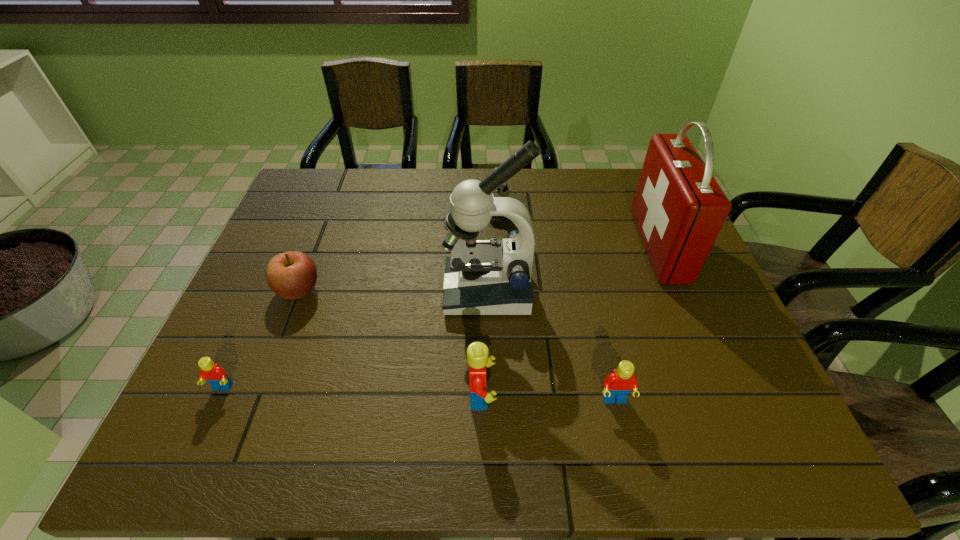
The image size is (960, 540). Find the location of `vacant space that's between the first-aid kit and the microphone`. vacant space that's between the first-aid kit and the microphone is located at coordinates tap(569, 230).

Identify the location of unoccupied position between the tallest Lego and the microscope. The height and width of the screenshot is (540, 960). (485, 343).

In order to click on free spot between the sixth shortest object and the tallest Lego in this screenshot , I will do `click(570, 321)`.

This screenshot has width=960, height=540. Find the location of `vacant space in between the apple and the rightmost Lego`. vacant space in between the apple and the rightmost Lego is located at coordinates (456, 345).

Locate an element on the screen. vacant region between the shortest object and the tallest Lego is located at coordinates (352, 392).

Identify the location of free space that is in between the microscope and the tallest Lego. This screenshot has height=540, width=960. (485, 343).

Select which object is the second closest to the microphone. Please provide its 2D coordinates. Your answer should be formatted as a tuple, i.e. [(x, y)], where the tuple contains the x and y coordinates of a point satisfying the conditions above.

[(679, 208)]

Locate an element on the screen. Image resolution: width=960 pixels, height=540 pixels. object identified as the closest to the second Lego from right to left is located at coordinates (482, 276).

Identify which Lego is located as the third nearest to the first-aid kit. Please provide its 2D coordinates. Your answer should be formatted as a tuple, i.e. [(x, y)], where the tuple contains the x and y coordinates of a point satisfying the conditions above.

[(215, 375)]

At what (x,y) coordinates should I click in order to perform the action: click on Lego that is the third nearest to the microscope. Please return your answer as a coordinate pair (x, y). Looking at the image, I should click on (215, 375).